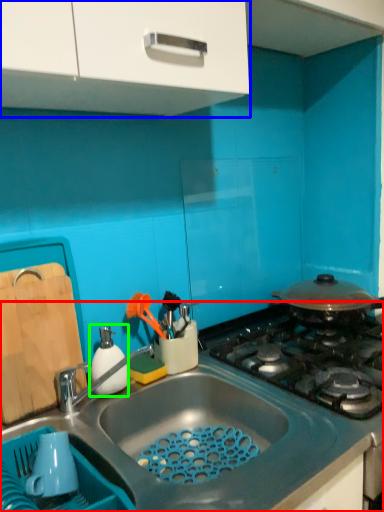
Question: Considering the real-world distances, which object is closest to countertop (highlighted by a red box)? cabinetry (highlighted by a blue box) or appliance (highlighted by a green box).

Choices:
 (A) cabinetry
 (B) appliance

Answer: (B)